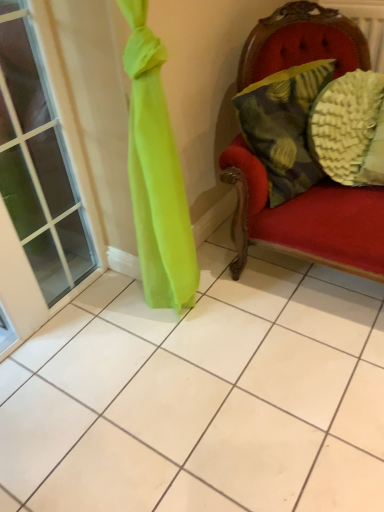
Question: Considering the positions of point (13, 211) and point (274, 196), is point (13, 211) closer or farther from the camera than point (274, 196)?

Choices:
 (A) closer
 (B) farther

Answer: (B)

Question: From the image's perspective, is clear glass window at left above or below textured yellow-green pillow at right, positioned as the 1th pillow in left-to-right order?

Choices:
 (A) below
 (B) above

Answer: (A)

Question: Which is farther from the textured yellow pillow at right, which ranks as the second pillow in left-to-right order?

Choices:
 (A) textured yellow-green pillow at right, which ranks as the 2th pillow in right-to-left order
 (B) clear glass window at left

Answer: (B)

Question: Estimate the real-world distances between objects in this image. Which object is closer to the clear glass window at left?

Choices:
 (A) textured yellow-green pillow at right, positioned as the 1th pillow in left-to-right order
 (B) textured yellow pillow at right, which ranks as the second pillow in left-to-right order

Answer: (A)